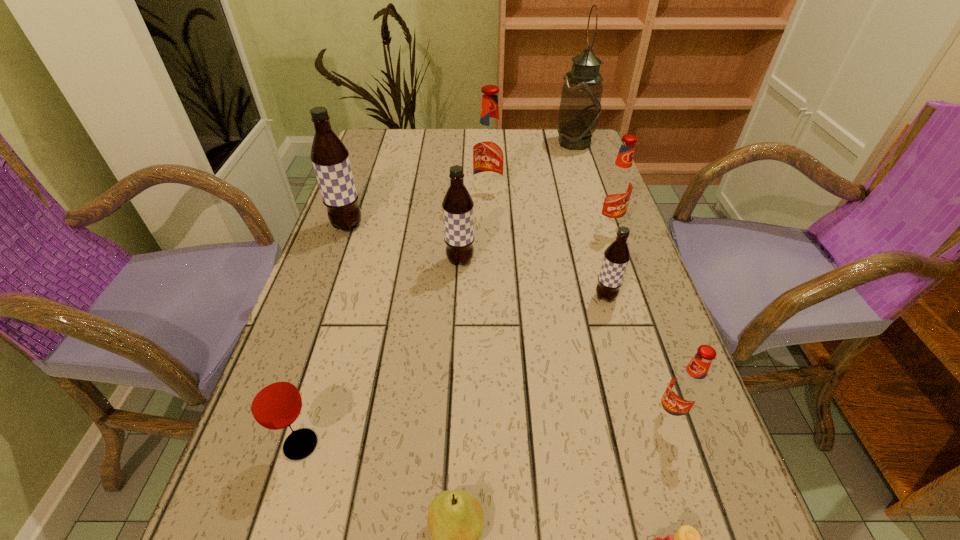
At what (x,y) coordinates should I click in order to perform the action: click on the third closest root beer relative to the second nearest brown root beer. Please return your answer as a coordinate pair (x, y). Looking at the image, I should click on (617, 255).

Point out which red root beer is positioned as the nearest to the Lego. Please provide its 2D coordinates. Your answer should be formatted as a tuple, i.e. [(x, y)], where the tuple contains the x and y coordinates of a point satisfying the conditions above.

[(687, 387)]

The width and height of the screenshot is (960, 540). In order to click on red root beer that is the closest one to the pear in this screenshot , I will do 687,387.

Identify the location of brown root beer that is the second nearest to the second nearest brown root beer. The width and height of the screenshot is (960, 540). (617, 255).

This screenshot has height=540, width=960. What are the coordinates of `the second closest brown root beer to the Lego` in the screenshot? It's located at pyautogui.click(x=458, y=217).

Where is `free point that satisfies the following two spatial constraints: 1. on the front side of the farthest brown root beer; 2. on the left side of the fourth farthest root beer`? The height and width of the screenshot is (540, 960). free point that satisfies the following two spatial constraints: 1. on the front side of the farthest brown root beer; 2. on the left side of the fourth farthest root beer is located at coordinates (335, 261).

Find the location of `free location that satisfies the following two spatial constraints: 1. on the back side of the second nearest red root beer; 2. on the left side of the second brown root beer from left to right`. free location that satisfies the following two spatial constraints: 1. on the back side of the second nearest red root beer; 2. on the left side of the second brown root beer from left to right is located at coordinates (462, 226).